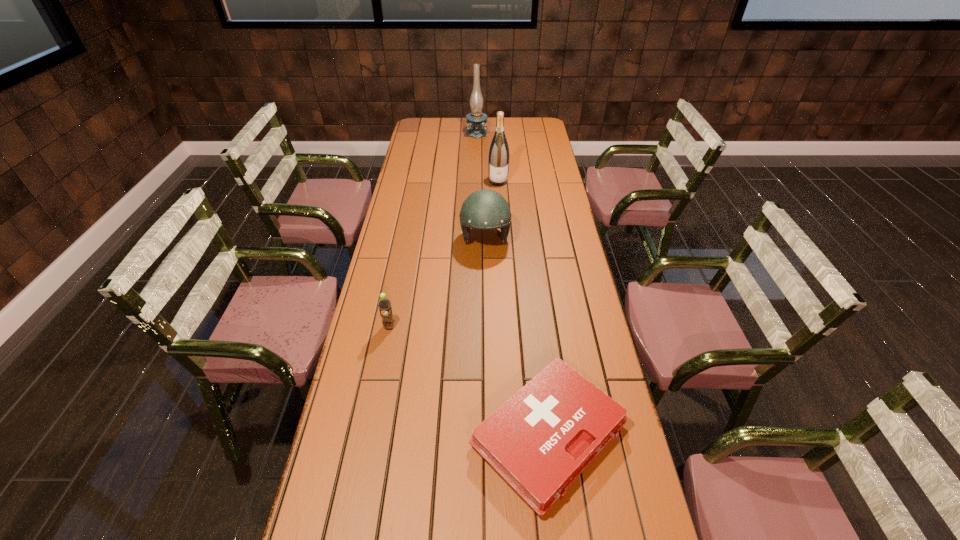
Where is `free space located 0.060m at the face opening of the football helmet`? Image resolution: width=960 pixels, height=540 pixels. free space located 0.060m at the face opening of the football helmet is located at coordinates (486, 268).

The height and width of the screenshot is (540, 960). I want to click on blank space located 0.080m on the front label of the fourth farthest object, so click(x=384, y=353).

This screenshot has height=540, width=960. I want to click on vacant space situated 0.290m on the back of the shortest object, so click(x=532, y=297).

You are a GUI agent. You are given a task and a screenshot of the screen. Output one action in this format:
    pyautogui.click(x=<x>, y=<y>)
    Task: Click on the object present at the far edge
    The width and height of the screenshot is (960, 540).
    Given the screenshot: What is the action you would take?
    pyautogui.click(x=476, y=121)

This screenshot has width=960, height=540. Identify the location of object situated at the left edge. (384, 304).

Image resolution: width=960 pixels, height=540 pixels. I want to click on object that is at the right edge, so click(539, 441).

What are the coordinates of `free space at the far edge` in the screenshot? It's located at (495, 128).

The image size is (960, 540). I want to click on vacant space at the left edge of the desktop, so click(359, 448).

This screenshot has width=960, height=540. In the image, there is a desktop. Find the location of `free region at the right edge`. free region at the right edge is located at coordinates (608, 444).

This screenshot has width=960, height=540. I want to click on free space at the far right corner, so click(533, 132).